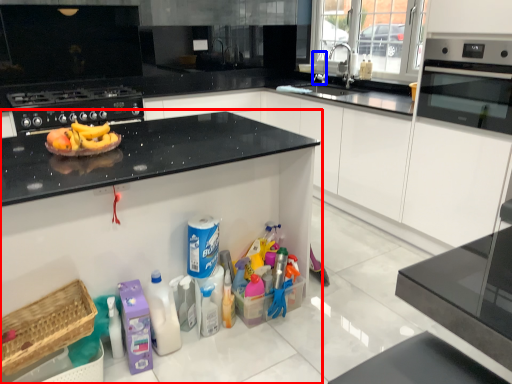
Question: Which point is closer to the camera, countertop (highlighted by a red box) or faucet (highlighted by a blue box)?

Choices:
 (A) countertop
 (B) faucet

Answer: (A)